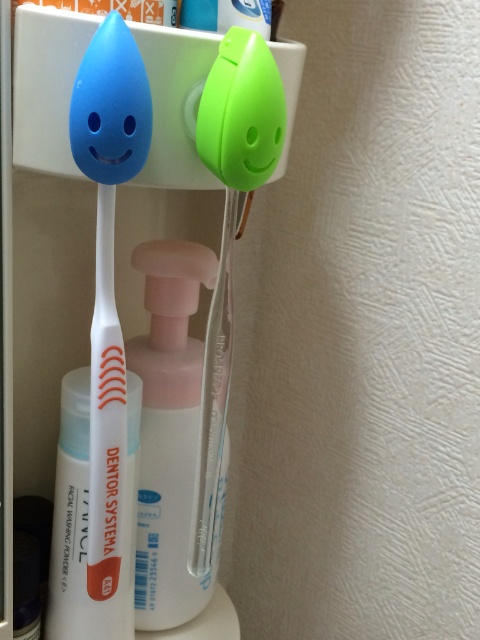
Question: Can you confirm if pink translucent pump at center is positioned to the left of white matte tube at center?

Choices:
 (A) yes
 (B) no

Answer: (B)

Question: Is matte white toothbrush at left positioned before pink translucent pump at center?

Choices:
 (A) yes
 (B) no

Answer: (A)

Question: Estimate the real-world distances between objects in this image. Which object is farther from the green matte toothpaste at upper center?

Choices:
 (A) pink translucent pump at center
 (B) matte white toothbrush at left
 (C) white matte tube at center

Answer: (C)

Question: Which point is farther from the camera taking this photo?

Choices:
 (A) (175, 380)
 (B) (219, 13)

Answer: (A)

Question: Which object is positioned farthest from the white matte tube at center?

Choices:
 (A) matte white toothbrush at left
 (B) pink translucent pump at center

Answer: (A)

Question: Does pink translucent pump at center have a lesser width compared to green matte toothpaste at upper center?

Choices:
 (A) yes
 (B) no

Answer: (B)